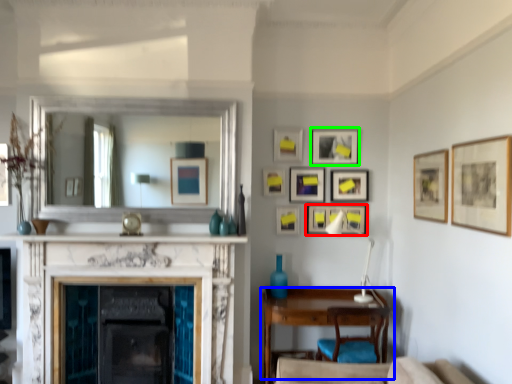
Question: Considering the real-world distances, which object is farthest from picture frame (highlighted by a red box)? table (highlighted by a blue box) or picture frame (highlighted by a green box)?

Choices:
 (A) table
 (B) picture frame

Answer: (A)